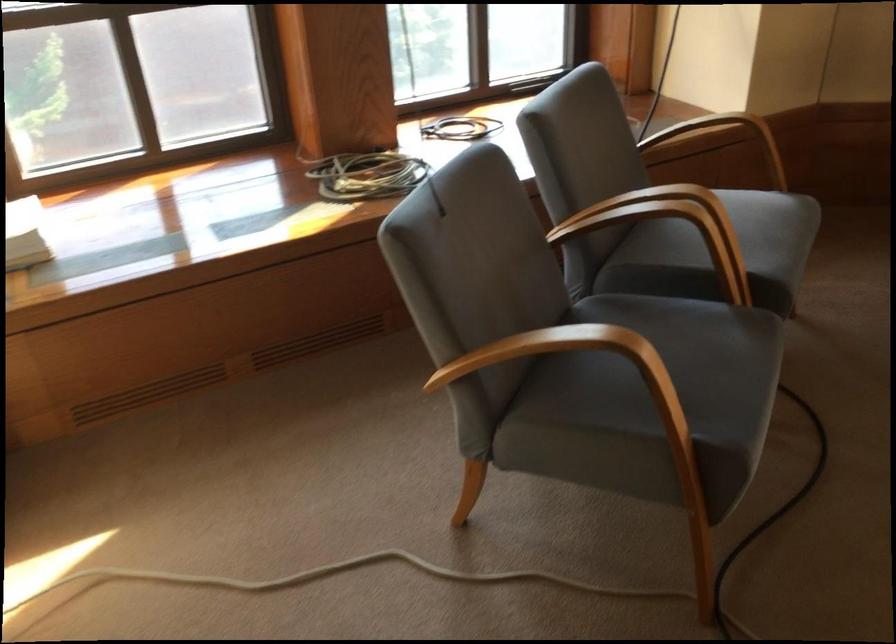
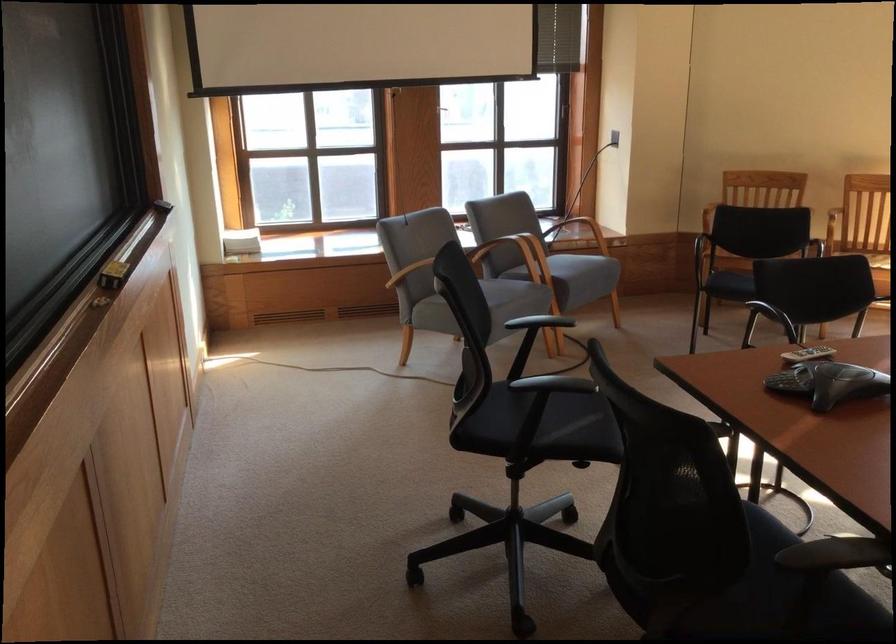
What movement of the cameraman would produce the second image?

The cameraman walked toward right, backward.